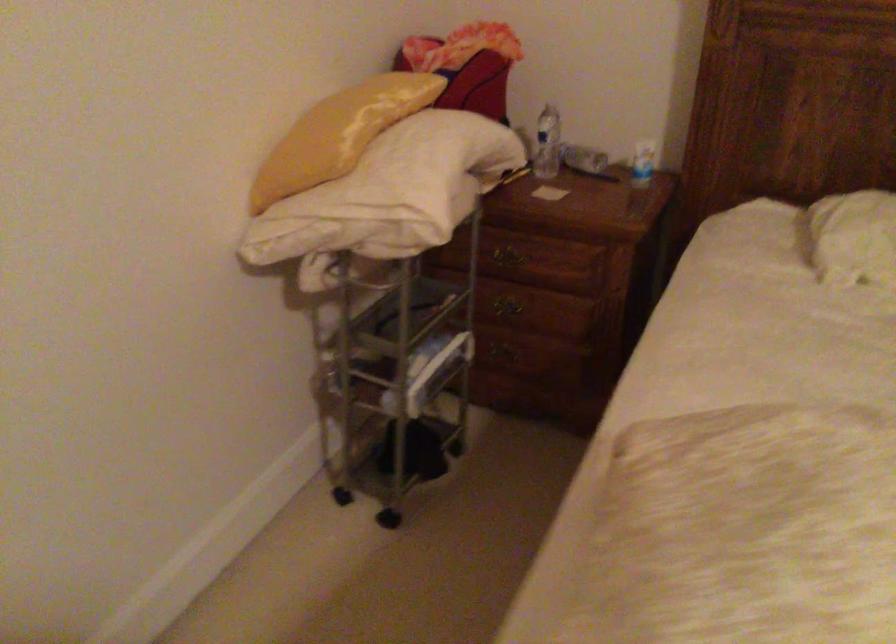
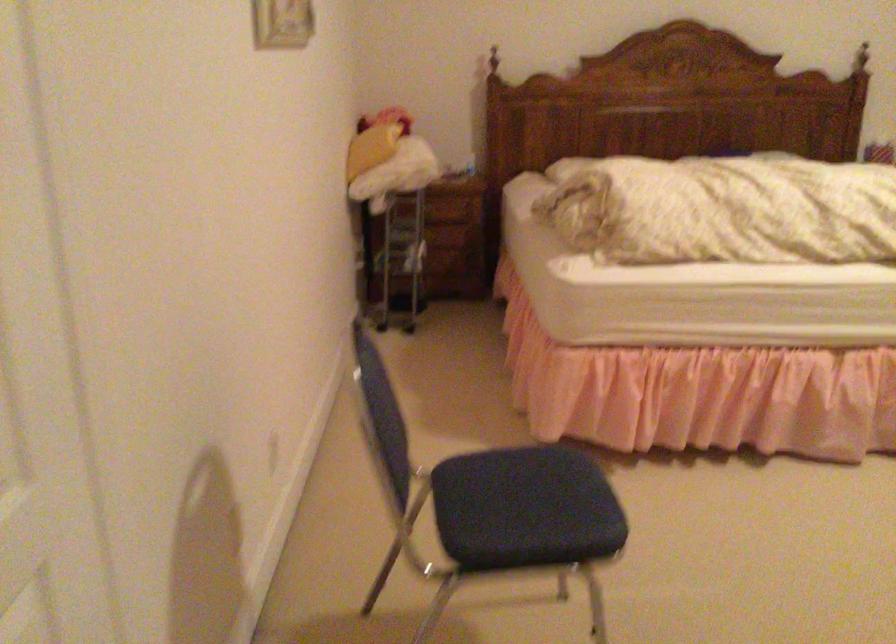
What movement of the cameraman would produce the second image?

The cameraman moved toward left, backward.